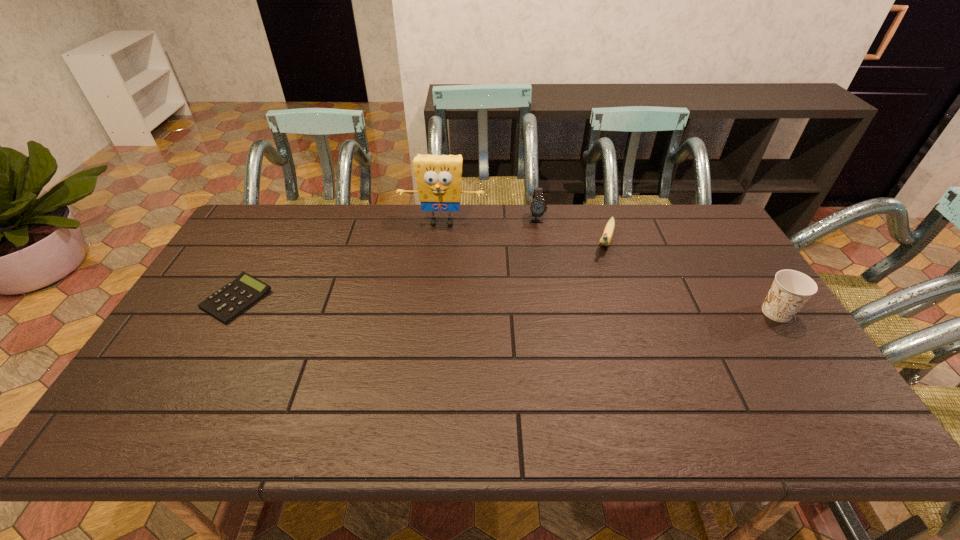
I want to click on vacant space on the desktop that is between the shortest object and the rightmost object and is positioned at the stem of the banana, so click(x=584, y=308).

Where is `free space on the desktop that is between the shortest object and the Dixie cup and is positioned on the face of the second object from left to right`? This screenshot has height=540, width=960. free space on the desktop that is between the shortest object and the Dixie cup and is positioned on the face of the second object from left to right is located at coordinates (429, 304).

Identify the location of free spot on the desktop that is between the calculator and the rightmost object and is positioned on the face of the third object from right to left. The height and width of the screenshot is (540, 960). (542, 307).